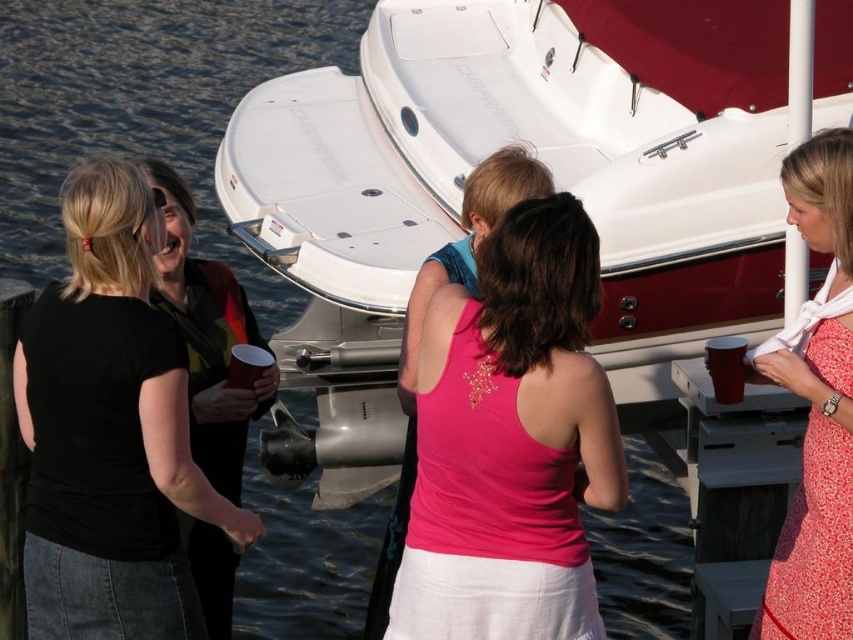
In the scene shown: Which is more to the right, black matte shirt at left or floral dress at center?

floral dress at center

Measure the distance between black matte shirt at left and camera.

black matte shirt at left and camera are 40.00 meters apart.

This screenshot has height=640, width=853. I want to click on black matte shirt at left, so click(x=109, y=429).

Which is behind, point (523, 563) or point (809, 412)?

Point (809, 412)

Is point (405, 621) farther from camera compared to point (840, 616)?

Yes, point (405, 621) is farther from viewer.

At what (x,y) coordinates should I click in order to perform the action: click on pink fabric tank top at center. Please return your answer as a coordinate pair (x, y). Image resolution: width=853 pixels, height=640 pixels. Looking at the image, I should click on (511, 442).

Does point (784, 630) lie behind point (763, 428)?

No.

Between floral dress at center and gray metallic dock at lower right, which one is positioned lower?

gray metallic dock at lower right is below.

Which is behind, point (833, 252) or point (730, 461)?

The point (730, 461) is more distant.

Locate an element on the screen. The image size is (853, 640). floral dress at center is located at coordinates (814, 490).